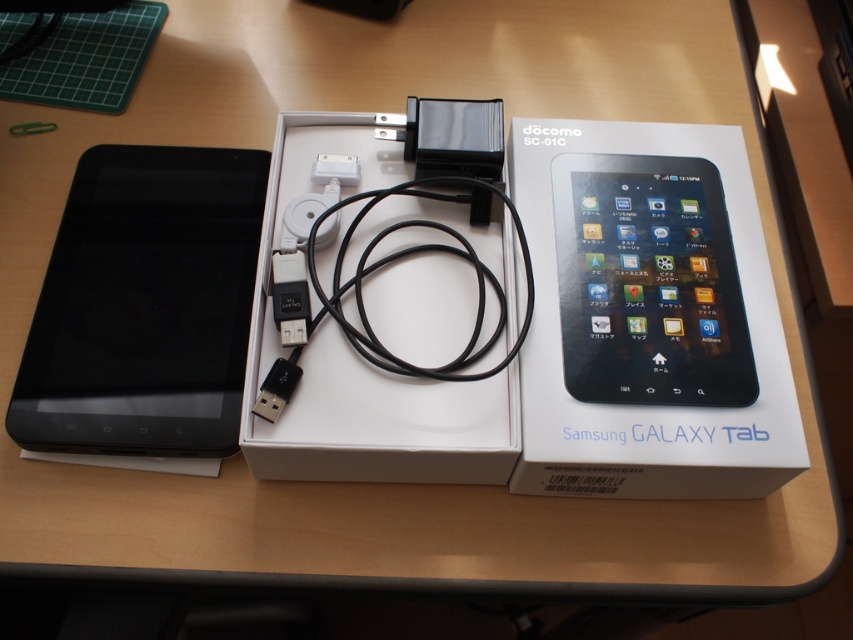
From the picture: Which of these two, white matte box at center or black matte tablet at left, stands shorter?

black matte tablet at left

Which is above, white matte box at center or black matte tablet at left?

white matte box at center is above.

Which is in front, point (378, 148) or point (122, 408)?

Positioned in front is point (122, 408).

Where is `white matte box at center`? This screenshot has width=853, height=640. white matte box at center is located at coordinates (354, 349).

Looking at this image, who is positioned more to the left, white matte samsung galaxy tab box at center or black glossy tablet at upper center?

Positioned to the left is white matte samsung galaxy tab box at center.

Image resolution: width=853 pixels, height=640 pixels. What do you see at coordinates (645, 317) in the screenshot? I see `white matte samsung galaxy tab box at center` at bounding box center [645, 317].

Who is more distant from viewer, [648,356] or [730,396]?

The point [648,356] is more distant.

The width and height of the screenshot is (853, 640). Find the location of `white matte samsung galaxy tab box at center`. white matte samsung galaxy tab box at center is located at coordinates [645, 317].

Does black glossy tablet at upper center have a greater width compared to black plastic usb plug at center?

Yes, black glossy tablet at upper center is wider than black plastic usb plug at center.

Is black glossy tablet at upper center below black plastic usb plug at center?

No.

Which is in front, point (724, 401) or point (286, 275)?

Point (724, 401) is more forward.

The image size is (853, 640). Find the location of `black glossy tablet at upper center`. black glossy tablet at upper center is located at coordinates (648, 282).